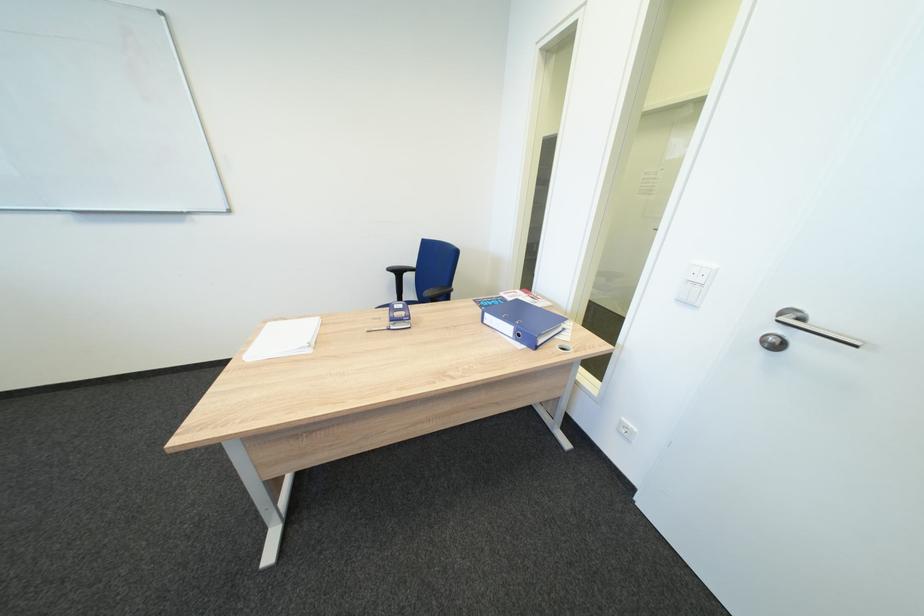
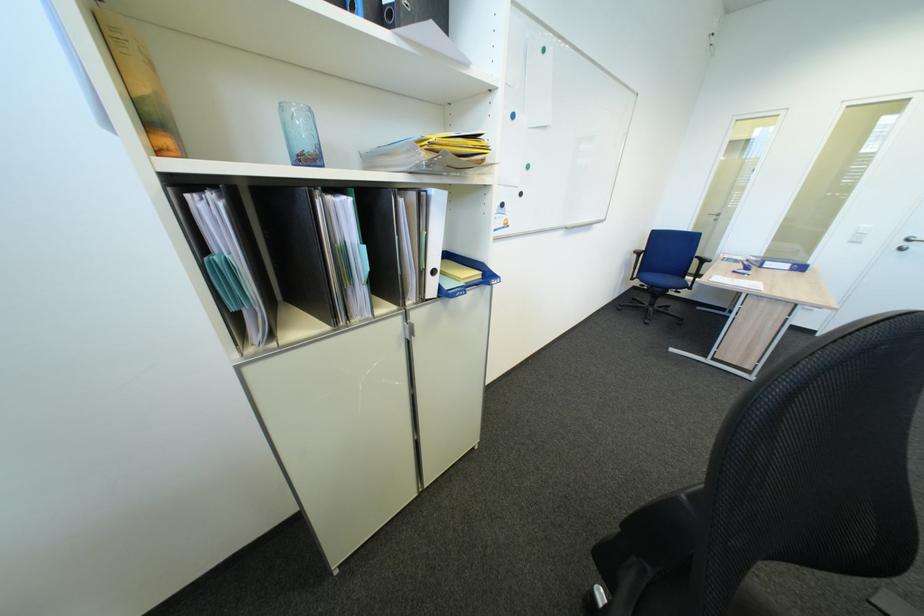
Where in the second image is the point corresponding to point 496,315 from the first image?

(776, 264)